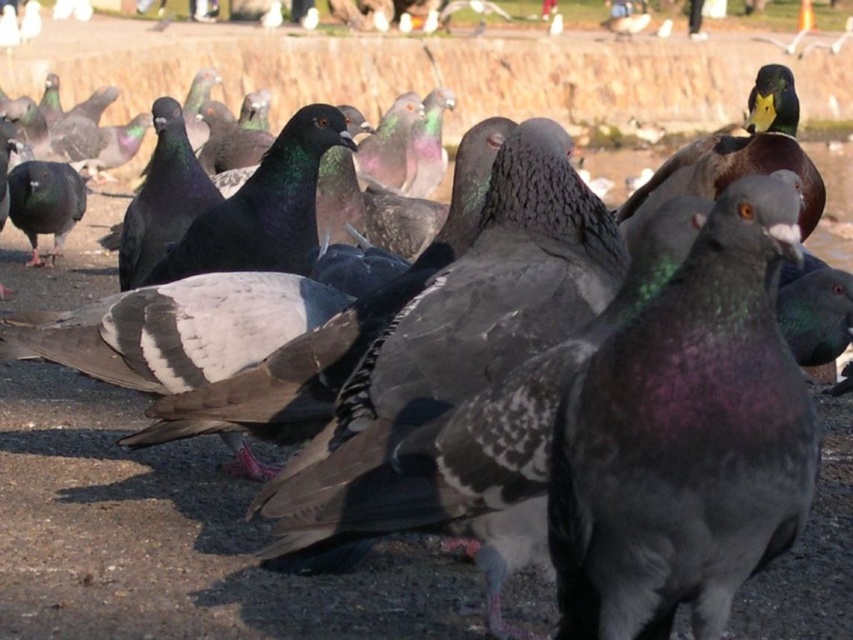
Question: Does shiny gray pigeon at center appear over green glossy duck at upper right?

Choices:
 (A) yes
 (B) no

Answer: (B)

Question: Among these objects, which one is nearest to the camera?

Choices:
 (A) green glossy duck at upper right
 (B) shiny gray pigeon at center

Answer: (B)

Question: Can you confirm if shiny gray pigeon at center is positioned above green glossy duck at upper right?

Choices:
 (A) yes
 (B) no

Answer: (B)

Question: Can you confirm if shiny gray pigeon at center is bigger than green glossy duck at upper right?

Choices:
 (A) yes
 (B) no

Answer: (B)